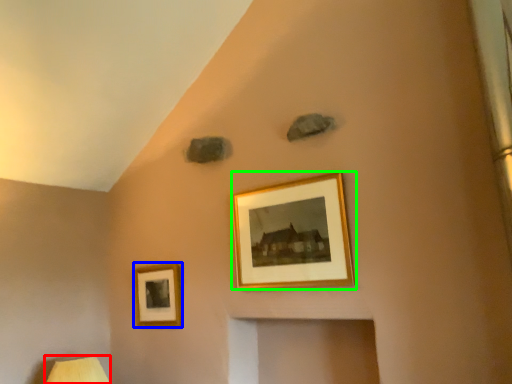
Question: Which is farther away from table lamp (highlighted by a red box)? picture frame (highlighted by a blue box) or picture frame (highlighted by a green box)?

Choices:
 (A) picture frame
 (B) picture frame

Answer: (B)